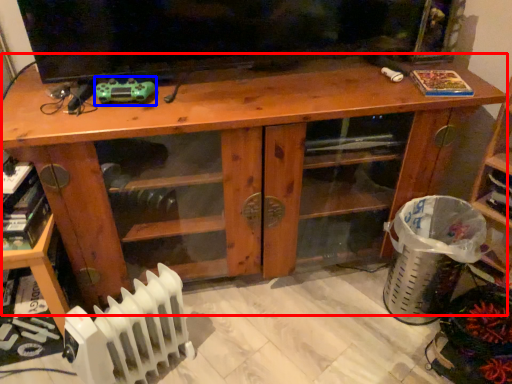
Question: Among these objects, which one is nearest to the camera, desk (highlighted by a red box) or toy (highlighted by a blue box)?

Choices:
 (A) desk
 (B) toy

Answer: (A)